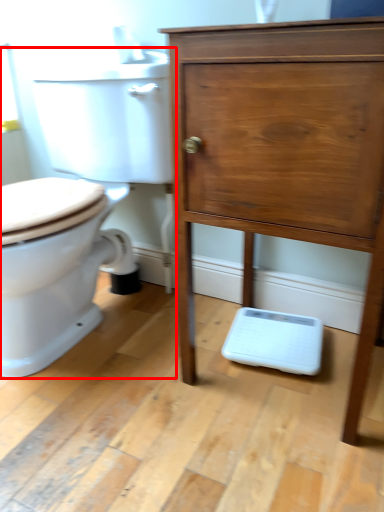
Question: From the image, what is the correct spatial relationship of toilet (annotated by the red box) in relation to chest of drawers?

Choices:
 (A) right
 (B) left

Answer: (B)